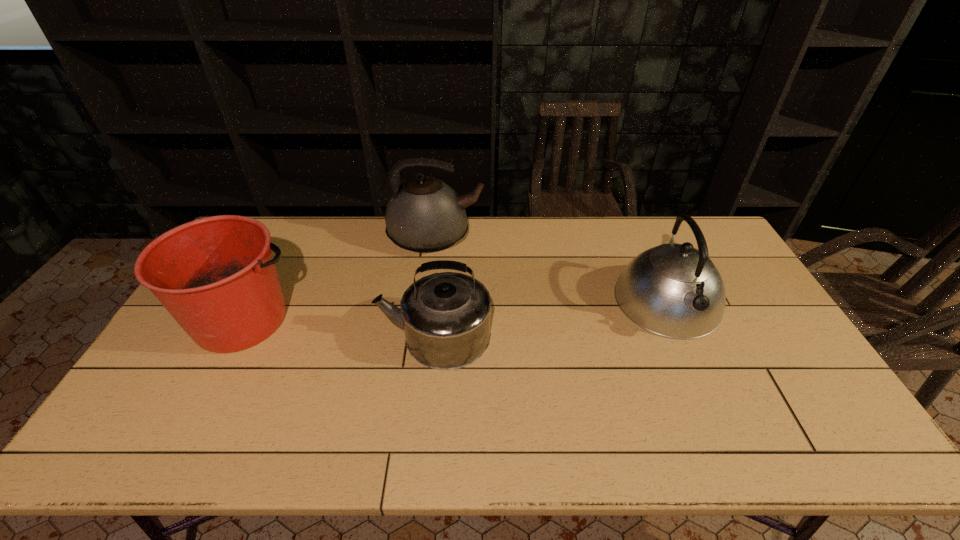
In the image, there is a desktop. Where is `vacant space at the near edge`? This screenshot has width=960, height=540. vacant space at the near edge is located at coordinates (712, 453).

This screenshot has height=540, width=960. What are the coordinates of `free space at the right edge of the desktop` in the screenshot? It's located at (774, 370).

I want to click on vacant space at the far left corner of the desktop, so click(x=295, y=217).

Where is `free spot between the farthest object and the bucket`? The height and width of the screenshot is (540, 960). free spot between the farthest object and the bucket is located at coordinates (340, 278).

The width and height of the screenshot is (960, 540). I want to click on free space between the rightmost object and the farthest object, so click(552, 269).

Locate which object ranks in proximity to the rightmost kettle. Please provide its 2D coordinates. Your answer should be formatted as a tuple, i.e. [(x, y)], where the tuple contains the x and y coordinates of a point satisfying the conditions above.

[(446, 316)]

Where is `object that is the third closest to the bucket`? object that is the third closest to the bucket is located at coordinates (674, 290).

Select which kettle appears as the second closest to the farthest object. Please provide its 2D coordinates. Your answer should be formatted as a tuple, i.e. [(x, y)], where the tuple contains the x and y coordinates of a point satisfying the conditions above.

[(674, 290)]

What are the coordinates of `the second closest kettle relative to the farthest object` in the screenshot? It's located at click(x=674, y=290).